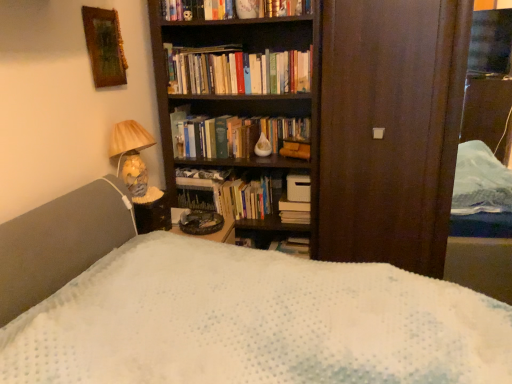
Locate an element on the screen. This screenshot has width=512, height=384. vacant space in matte ceramic lamp at left (from a real-world perspective) is located at coordinates (142, 193).